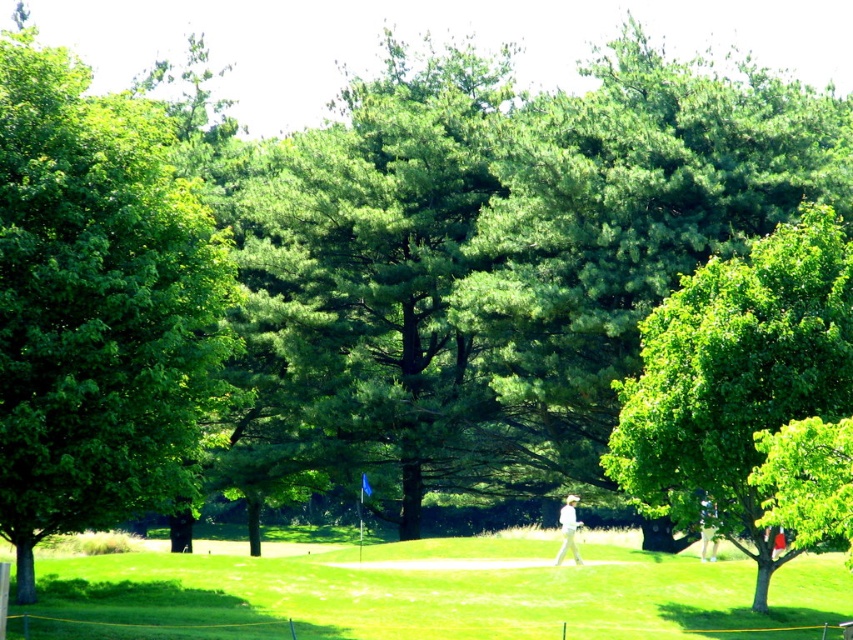
Can you confirm if green grassy field at center is taller than green leafy tree at right?

Incorrect, green grassy field at center's height is not larger of green leafy tree at right's.

Between point (480, 552) and point (735, 268), which one is positioned in front?

Point (735, 268) is in front.

Find the location of a particular element. green grassy field at center is located at coordinates (428, 595).

Which is more to the right, green leafy tree at right or white fabric golfer at center?

From the viewer's perspective, green leafy tree at right appears more on the right side.

Who is taller, green leafy tree at right or white fabric golfer at center?

green leafy tree at right

Is point (820, 310) positioned after point (567, 525)?

No.

Find the location of a particular element. The image size is (853, 640). green leafy tree at right is located at coordinates (735, 378).

Consider the image. Between green leafy tree at left and green leafy tree at right, which one is positioned higher?

Positioned higher is green leafy tree at left.

Does point (165, 140) lie in front of point (801, 388)?

No, it is behind (801, 388).

Identify the location of green leafy tree at left. The image size is (853, 640). (97, 305).